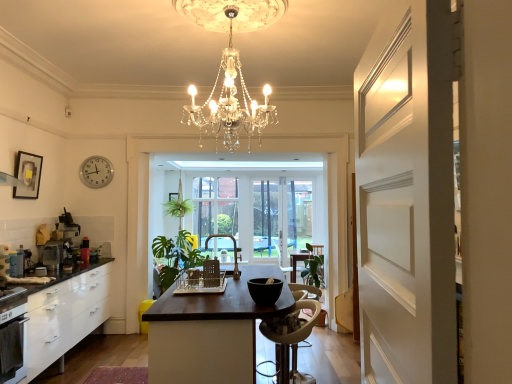
The width and height of the screenshot is (512, 384). I want to click on free space behind metallic silver chair at center, which is the 1th chair from left to right, so click(209, 279).